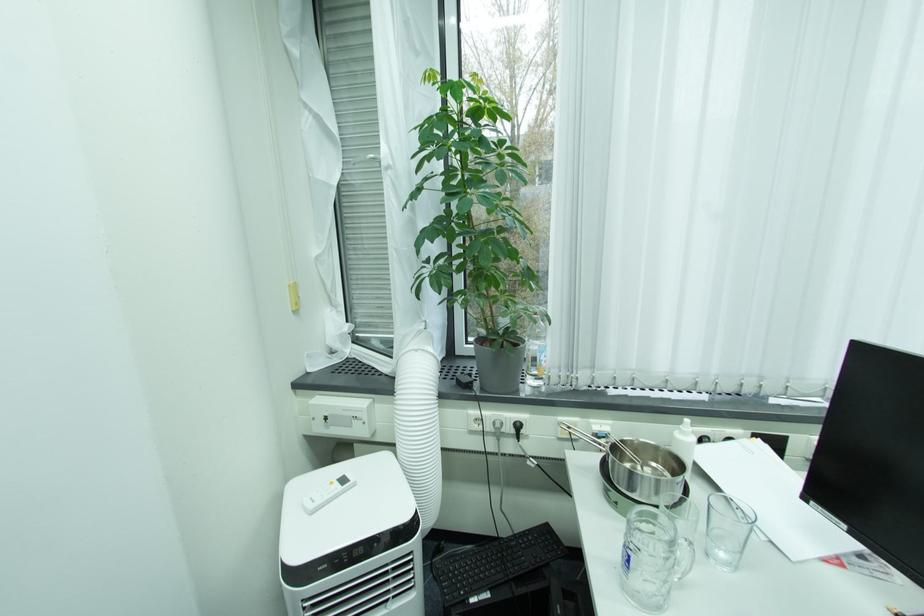
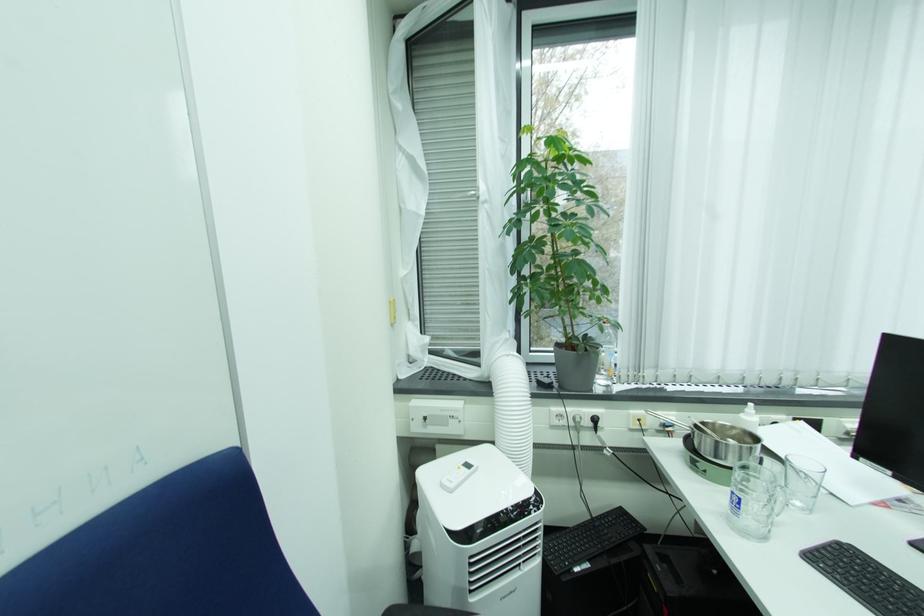
Question: The images are taken continuously from a first-person perspective. In which direction is your viewpoint rotating?

Choices:
 (A) Left
 (B) Right
 (C) Up
 (D) Down

Answer: (C)